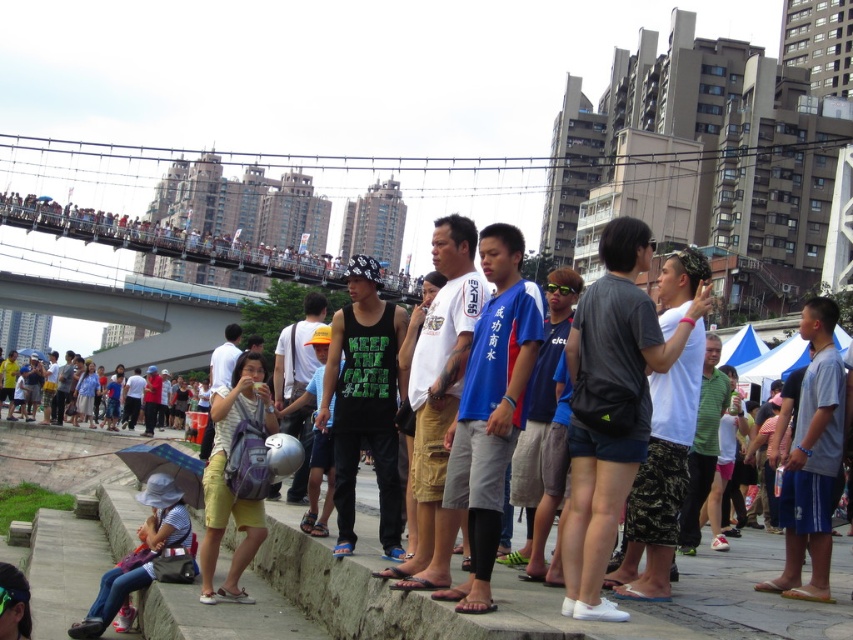
Question: Which point is closer to the camera?

Choices:
 (A) (532, 358)
 (B) (36, 356)
 (C) (430, 388)

Answer: (A)

Question: Can you confirm if white cotton t-shirt at center is smaller than matte black backpack at center?

Choices:
 (A) no
 (B) yes

Answer: (B)

Question: Does blue fabric shirt at center appear on the left side of matte black backpack at center?

Choices:
 (A) no
 (B) yes

Answer: (A)

Question: Considering the real-world distances, which object is closest to the matte black backpack at center?

Choices:
 (A) blue fabric shirt at center
 (B) white cotton t-shirt at center

Answer: (B)

Question: Which of the following is the farthest from the observer?

Choices:
 (A) (529, 308)
 (B) (428, 458)

Answer: (A)

Question: Is blue fabric shirt at center smaller than white cotton t-shirt at center?

Choices:
 (A) yes
 (B) no

Answer: (A)